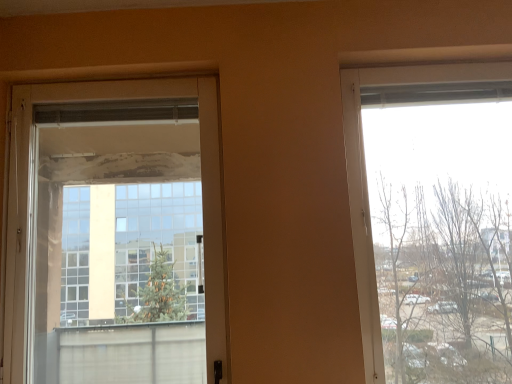
Locate an element on the screen. This screenshot has height=384, width=512. transparent glass door at left is located at coordinates click(x=201, y=167).

Image resolution: width=512 pixels, height=384 pixels. What do you see at coordinates (201, 167) in the screenshot?
I see `transparent glass door at left` at bounding box center [201, 167].

What do you see at coordinates (367, 183) in the screenshot?
I see `transparent glass window at right` at bounding box center [367, 183].

The image size is (512, 384). Find the location of `transparent glass window at right`. transparent glass window at right is located at coordinates (367, 183).

At what (x,y) coordinates should I click in order to perform the action: click on transparent glass door at left. Please return your answer as a coordinate pair (x, y). The image size is (512, 384). Looking at the image, I should click on (201, 167).

Can you confirm if transparent glass door at left is positioned to the left of transparent glass window at right?

Yes.

Is transparent glass door at left in front of transparent glass window at right?

That is False.

Is point (207, 363) less distant than point (356, 189)?

No, it is behind (356, 189).

From the image's perspective, is transparent glass door at left located above or below transparent glass window at right?

transparent glass door at left is below transparent glass window at right.

From a real-world perspective, is transparent glass door at left below transparent glass window at right?

Incorrect, from a real-world perspective, transparent glass door at left is higher than transparent glass window at right.

Which of these two, transparent glass door at left or transparent glass window at right, is thinner?

transparent glass door at left is thinner.

From their relative heights in the image, would you say transparent glass door at left is taller or shorter than transparent glass window at right?

Clearly, transparent glass door at left is shorter compared to transparent glass window at right.

Which of these two, transparent glass door at left or transparent glass window at right, is smaller?

transparent glass door at left is smaller.

Consider the image. Is transparent glass door at left completely or partially outside of transparent glass window at right?

Indeed, transparent glass door at left is completely outside transparent glass window at right.

Is transparent glass door at left with transparent glass window at right?

There is a gap between transparent glass door at left and transparent glass window at right.

Looking at this image, is transparent glass door at left facing away from transparent glass window at right?

No, transparent glass door at left is not facing the opposite direction of transparent glass window at right.

What's the angular difference between transparent glass door at left and transparent glass window at right's facing directions?

The angular difference between transparent glass door at left and transparent glass window at right is 0.00497 degrees.

I want to click on window in front of the transparent glass door at left, so click(367, 183).

In the image, is transparent glass window at right on the left side or the right side of transparent glass door at left?

Based on their positions, transparent glass window at right is located to the right of transparent glass door at left.

Between transparent glass window at right and transparent glass door at left, which one is positioned behind?

transparent glass door at left is further from the camera.

Considering the positions of points (366, 243) and (12, 285), is point (366, 243) farther from camera compared to point (12, 285)?

Yes, it is.

From the image's perspective, is transparent glass window at right located above or below transparent glass door at left?

transparent glass window at right is situated higher than transparent glass door at left in the image.

From a real-world perspective, is transparent glass window at right positioned above or below transparent glass door at left?

In terms of real-world spatial position, transparent glass window at right is below transparent glass door at left.

Can you confirm if transparent glass window at right is wider than transparent glass door at left?

Indeed, transparent glass window at right has a greater width compared to transparent glass door at left.

Considering the sizes of objects transparent glass window at right and transparent glass door at left in the image provided, who is shorter, transparent glass window at right or transparent glass door at left?

transparent glass door at left.

Between transparent glass window at right and transparent glass door at left, which one has smaller size?

Smaller between the two is transparent glass door at left.

Which is correct: transparent glass window at right is inside transparent glass door at left, or outside of it?

transparent glass window at right exists outside the volume of transparent glass door at left.

Would you consider transparent glass window at right to be distant from transparent glass door at left?

transparent glass window at right is near transparent glass door at left, not far away.

Is transparent glass window at right facing towards transparent glass door at left?

No, transparent glass window at right is not oriented towards transparent glass door at left.

How many degrees apart are the facing directions of transparent glass window at right and transparent glass door at left?

The angle between the facing direction of transparent glass window at right and the facing direction of transparent glass door at left is 0.00497 degrees.

How distant is transparent glass window at right from transparent glass door at left?

The distance of transparent glass window at right from transparent glass door at left is 29.32 inches.

Find the location of a particular element. The image size is (512, 384). window that is in front of the transparent glass door at left is located at coordinates (367, 183).

Where is `door on the left side of transparent glass window at right`? The height and width of the screenshot is (384, 512). door on the left side of transparent glass window at right is located at coordinates (x=201, y=167).

Find the location of a particular element. window that appears on the right of transparent glass door at left is located at coordinates (367, 183).